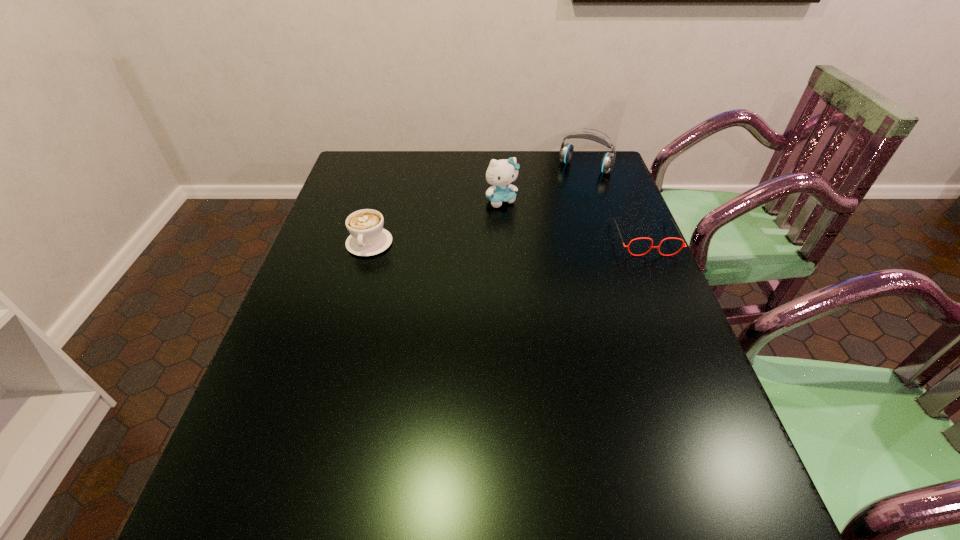
Locate an element on the screen. vacant spot on the desktop that is between the cappuccino and the shortest object and is positioned on the face of the kitten is located at coordinates (535, 240).

The image size is (960, 540). In order to click on vacant space on the desktop that is between the cappuccino and the shortest object and is positioned on the ear cups of the farthest object in this screenshot , I will do tap(535, 240).